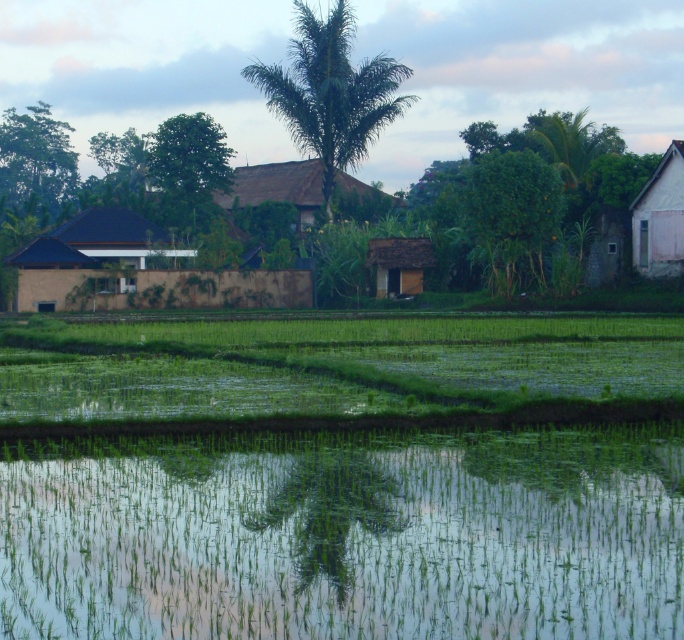
Question: Which object appears farthest from the camera in this image?

Choices:
 (A) brown textured hut at left
 (B) green grassy rice field at lower center

Answer: (A)

Question: Is green grassy flood at bottom further to camera compared to brown textured hut at left?

Choices:
 (A) yes
 (B) no

Answer: (B)

Question: Which point is closer to the camera?

Choices:
 (A) brown thatched hut at center
 (B) green grassy flood at bottom
 (C) brown textured hut at left

Answer: (B)

Question: Does green grassy rice field at lower center appear over brown thatched hut at center?

Choices:
 (A) yes
 (B) no

Answer: (B)

Question: Is green grassy flood at bottom below brown thatched hut at center?

Choices:
 (A) yes
 (B) no

Answer: (A)

Question: Which point is closer to the camera?

Choices:
 (A) green grassy rice field at lower center
 (B) white painted wood hut at right
 (C) brown textured hut at left
 (D) brown thatched hut at center

Answer: (A)